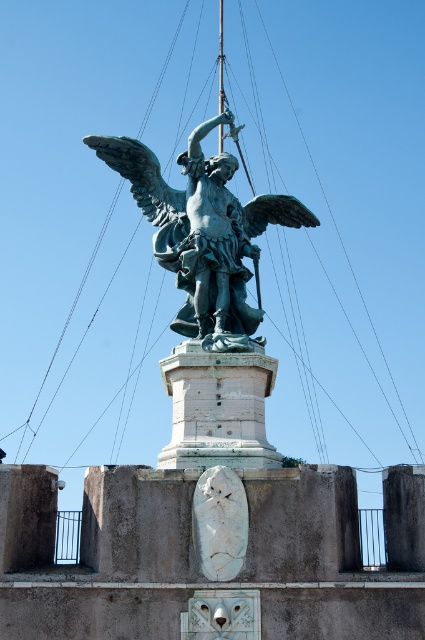
Between point (227, 244) and point (181, 342), which one is positioned in front?

Positioned in front is point (181, 342).

Is point (206, 250) farther from viewer compared to point (221, 356)?

Yes.

Does point (229, 336) come in front of point (240, 417)?

No, it is behind (240, 417).

In order to click on green patina statue at center in this screenshot , I will do `click(203, 232)`.